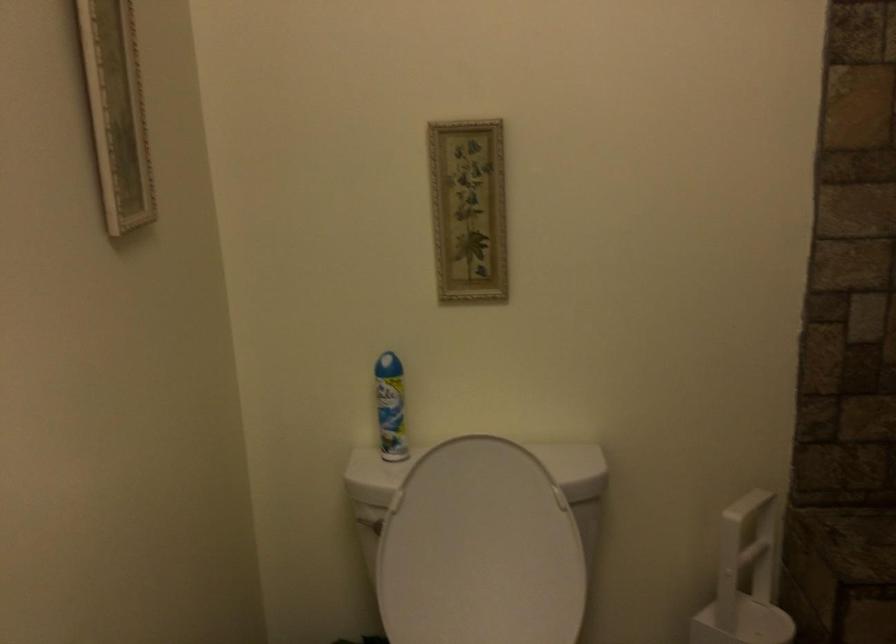
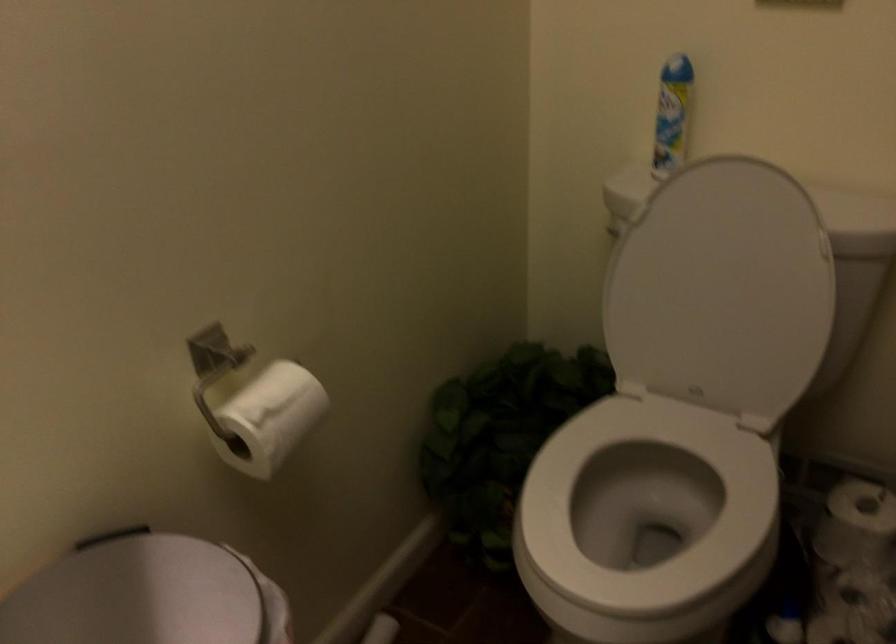
In the second image, find the point that corresponds to the point at 394,406 in the first image.

(672, 114)